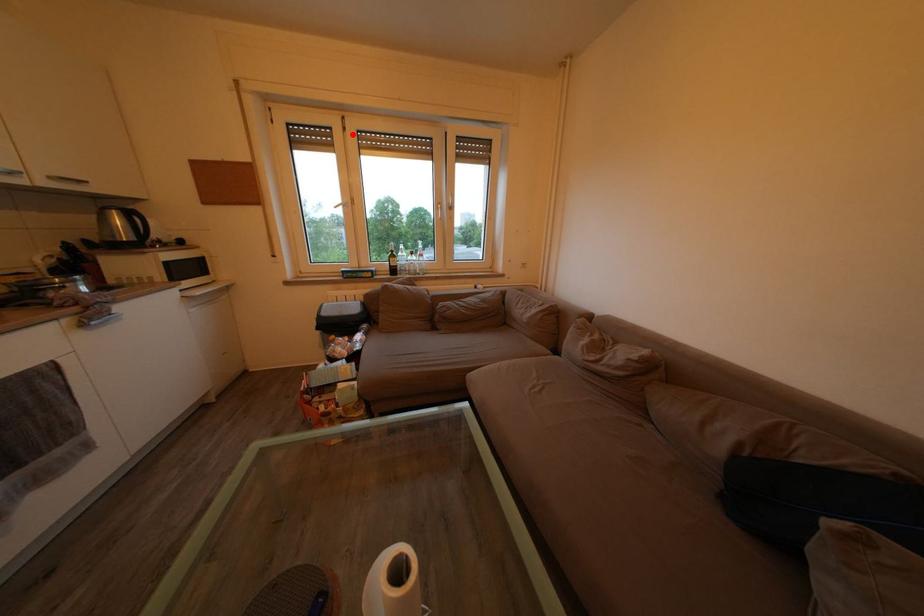
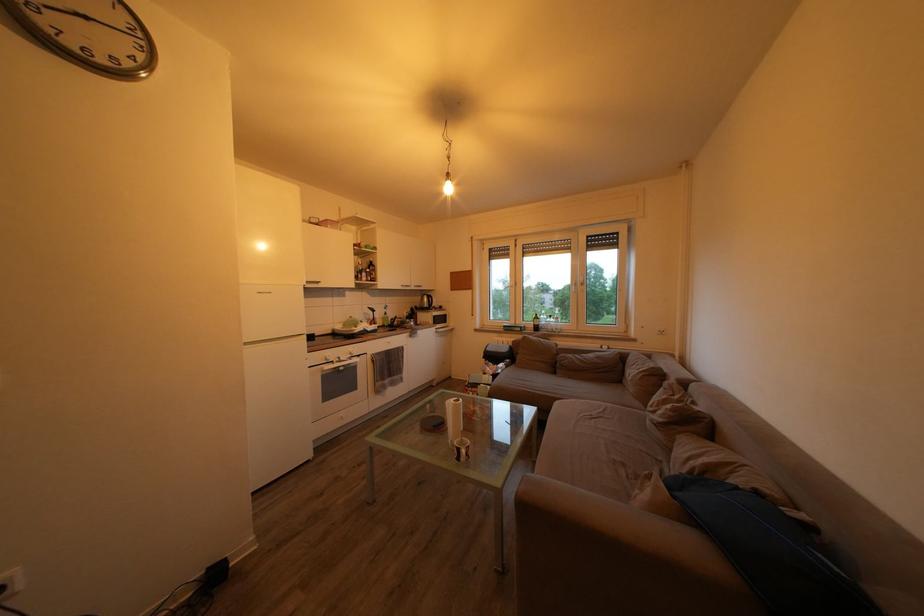
Find the pixel in the second image that matches the highlighted location in the first image.

(524, 252)